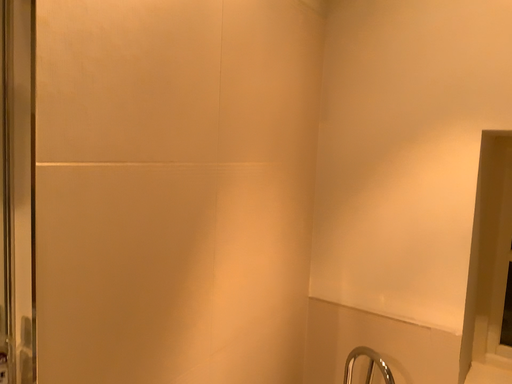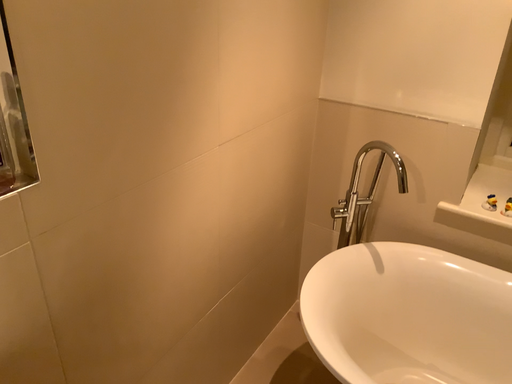
Question: Which way did the camera rotate in the video?

Choices:
 (A) rotated downward
 (B) rotated upward

Answer: (A)